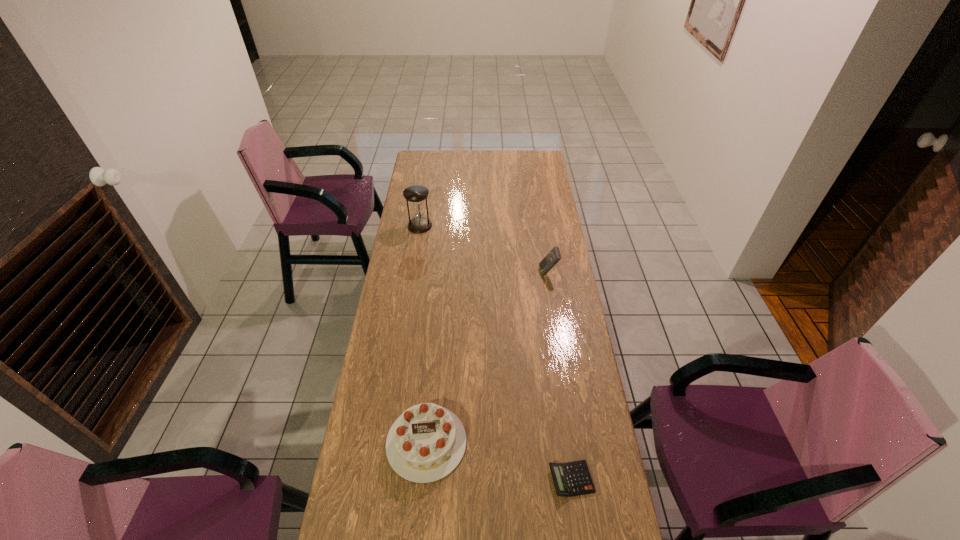
This screenshot has height=540, width=960. What are the coordinates of `vacant region that satisfies the following two spatial constraints: 1. on the front-facing side of the second farthest object; 2. on the front side of the shortest object` in the screenshot? It's located at (581, 480).